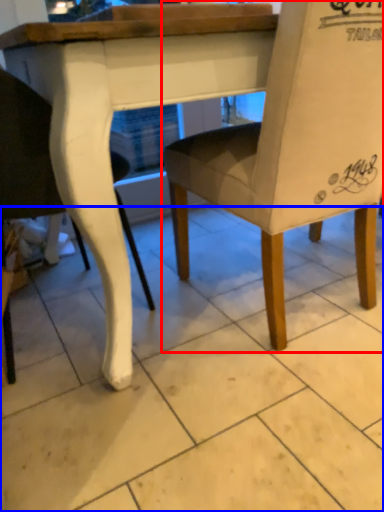
Question: Which object is further to the camera taking this photo, chair (highlighted by a red box) or tile (highlighted by a blue box)?

Choices:
 (A) chair
 (B) tile

Answer: (A)